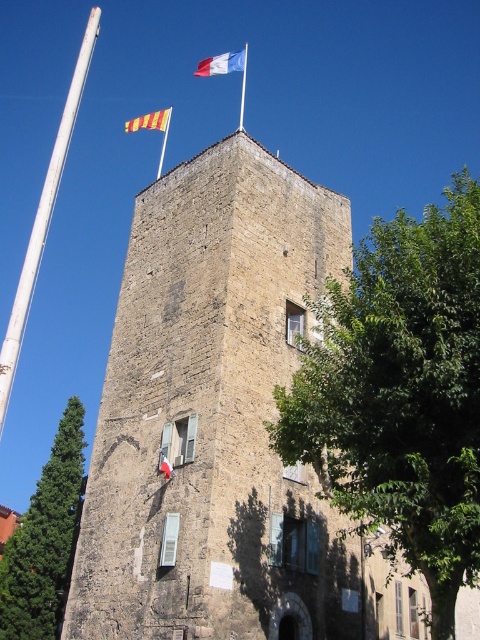
Is white fabric flag at top center bigger than red fabric flag at upper center?

Yes, white fabric flag at top center is bigger than red fabric flag at upper center.

Can you confirm if white fabric flag at top center is positioned to the left of red fabric flag at upper center?

Indeed, white fabric flag at top center is positioned on the left side of red fabric flag at upper center.

The height and width of the screenshot is (640, 480). Find the location of `white fabric flag at top center`. white fabric flag at top center is located at coordinates (223, 64).

Image resolution: width=480 pixels, height=640 pixels. Identify the location of white fabric flag at top center. (223, 64).

The height and width of the screenshot is (640, 480). Identify the location of white plastic flag pole at upper center. (164, 134).

Does white plastic flag pole at upper center have a lesser height compared to red fabric flag at upper center?

No.

What are the coordinates of `white plastic flag pole at upper center` in the screenshot? It's located at (164, 134).

Is brown stone tower at center shorter than green leafy tree at left?

Yes, brown stone tower at center is shorter than green leafy tree at left.

Can you confirm if brown stone tower at center is wider than green leafy tree at left?

In fact, brown stone tower at center might be narrower than green leafy tree at left.

Image resolution: width=480 pixels, height=640 pixels. In order to click on brown stone tower at center in this screenshot , I will do `click(213, 417)`.